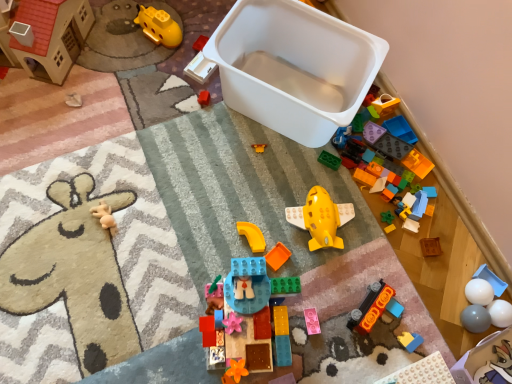
Locate an element on the screen. free space that is in between white plastic storage box at upper center, the 2th storage box in the right-to-left sequence, and translucent blue plastic building block at center, the fifth toy viewed from the left is located at coordinates (256, 206).